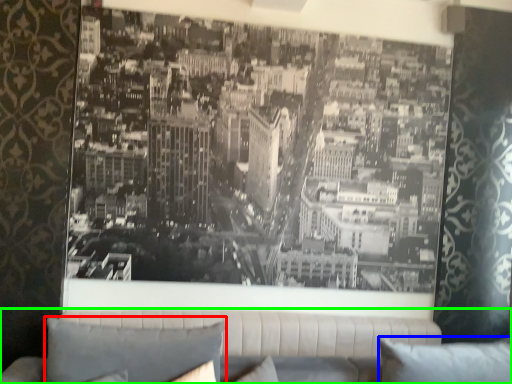
Question: Based on their relative distances, which object is farther from pillow (highlighted by a red box)? Choose from pillow (highlighted by a blue box) and studio couch (highlighted by a green box).

Choices:
 (A) pillow
 (B) studio couch

Answer: (A)